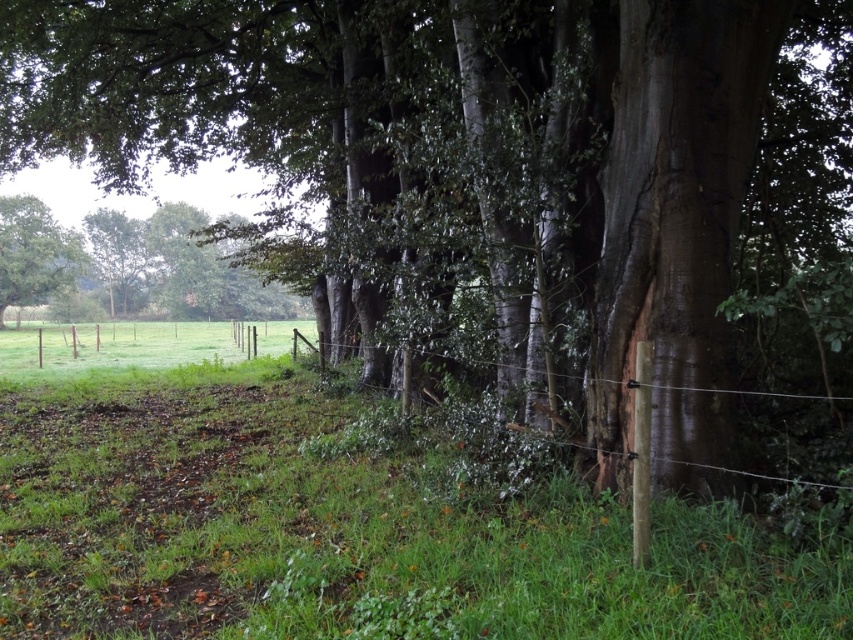
Question: Does green leafy tree at left lie behind wooden post at center-right?

Choices:
 (A) no
 (B) yes

Answer: (B)

Question: Is green leafy tree at left closer to camera compared to wooden post at center-right?

Choices:
 (A) no
 (B) yes

Answer: (A)

Question: Which object is closer to the camera taking this photo?

Choices:
 (A) green leafy tree at left
 (B) wooden post at center-right

Answer: (B)

Question: Which object appears farthest from the camera in this image?

Choices:
 (A) wooden post at center-right
 (B) green leafy tree at left

Answer: (B)

Question: From the image, what is the correct spatial relationship of green leafy tree at left in relation to wooden post at center-right?

Choices:
 (A) left
 (B) right

Answer: (A)